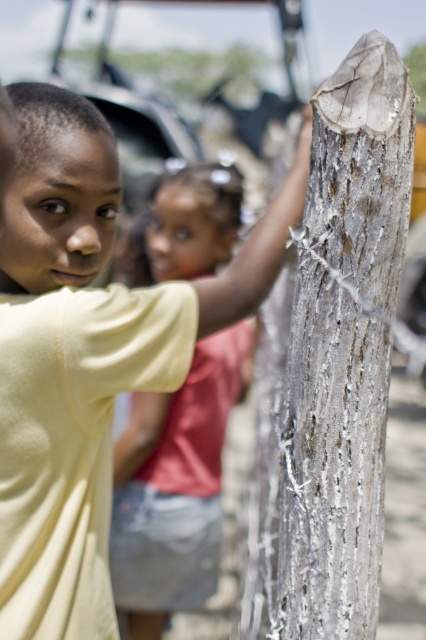
You are a photographer trying to capture the matte yellow shirt at center and the gray rough wood post at right in the same frame. Since you want both subjects to be in focus, which object should you position closer to the camera to ensure depth of field?

The gray rough wood post at right is closer to the viewer than the matte yellow shirt at center. To ensure both are in focus, you should position the camera closer to the gray rough wood post at right so that the distance between the two subjects is minimized within the depth of field.

In the scene shown: You are a photographer trying to capture the gray rough wood post at right. From your current position, can you see the yellow matte shirt at upper left blocking the view of the post?

The yellow matte shirt at upper left is in front of the gray rough wood post at right, so yes, the shirt is blocking the view of the post.

You are a photographer trying to capture both the yellow matte shirt at upper left and the matte yellow shirt at center in a single shot. Which shirt should you focus on first to ensure both are in focus?

The yellow matte shirt at upper left is closer to the viewer than the matte yellow shirt at center, so focusing on the closer shirt first will help ensure both are in focus.